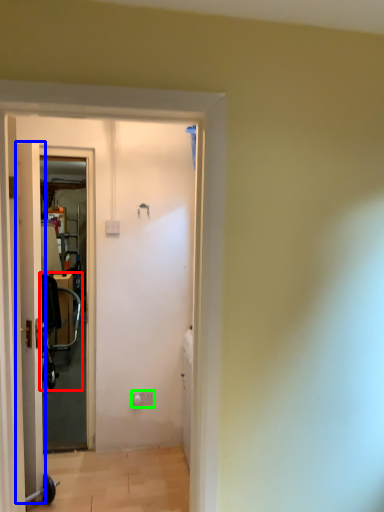
Question: Based on their relative distances, which object is farther from baby carriage (highlighted by a red box)? Choose from door (highlighted by a blue box) and electric outlet (highlighted by a green box).

Choices:
 (A) door
 (B) electric outlet

Answer: (A)